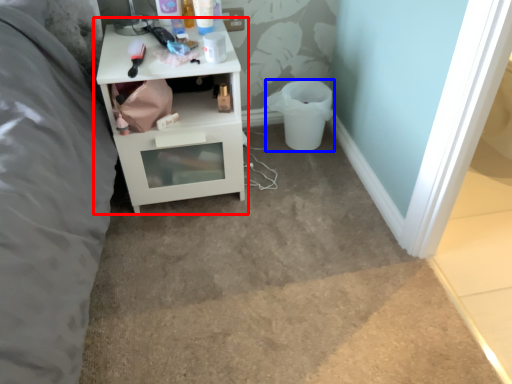
Question: Which of the following is the farthest to the observer, nightstand (highlighted by a red box) or toilet bowl (highlighted by a blue box)?

Choices:
 (A) nightstand
 (B) toilet bowl

Answer: (B)